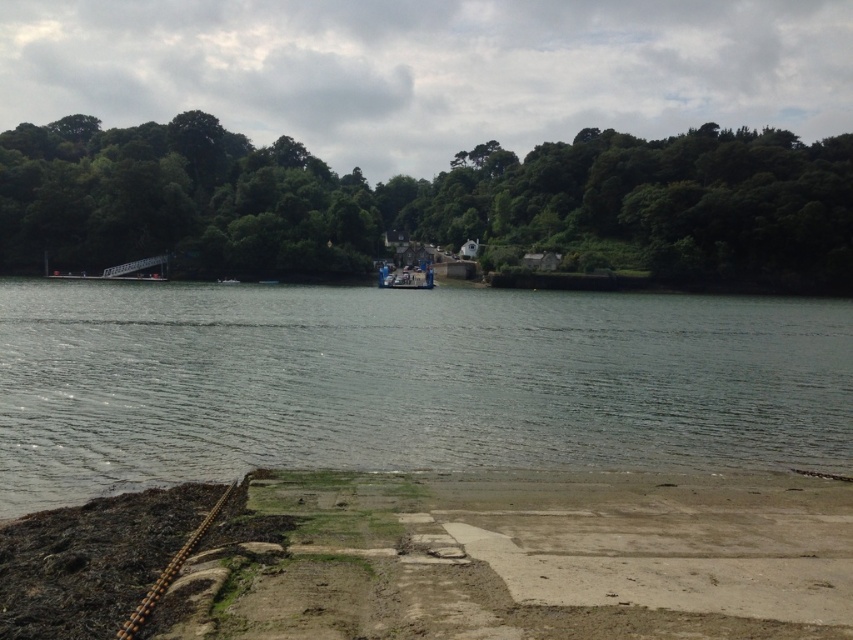
You are a photographer planning to take a photo of the green leafy trees at center and the metallic blue boat at center from the dock. Which object will appear larger in the photo?

The green leafy trees at center will appear larger in the photo because they are much taller than the metallic blue boat at center.